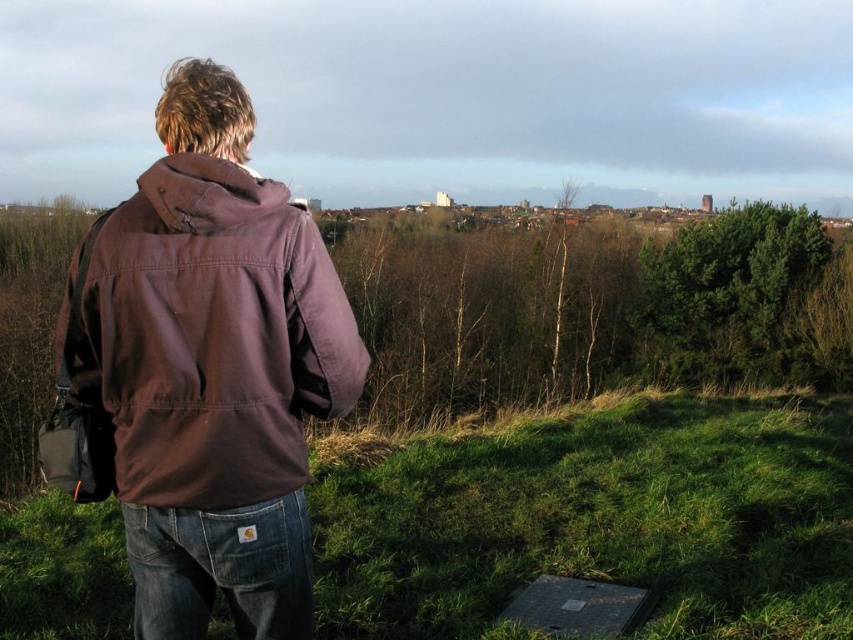
The width and height of the screenshot is (853, 640). Find the location of `green grassy at lower left`. green grassy at lower left is located at coordinates (601, 522).

Does green grassy at lower left appear under brown cotton jacket at left?

Yes, green grassy at lower left is below brown cotton jacket at left.

Measure the distance between green grassy at lower left and camera.

The distance of green grassy at lower left from camera is 3.97 meters.

Locate an element on the screen. green grassy at lower left is located at coordinates (601, 522).